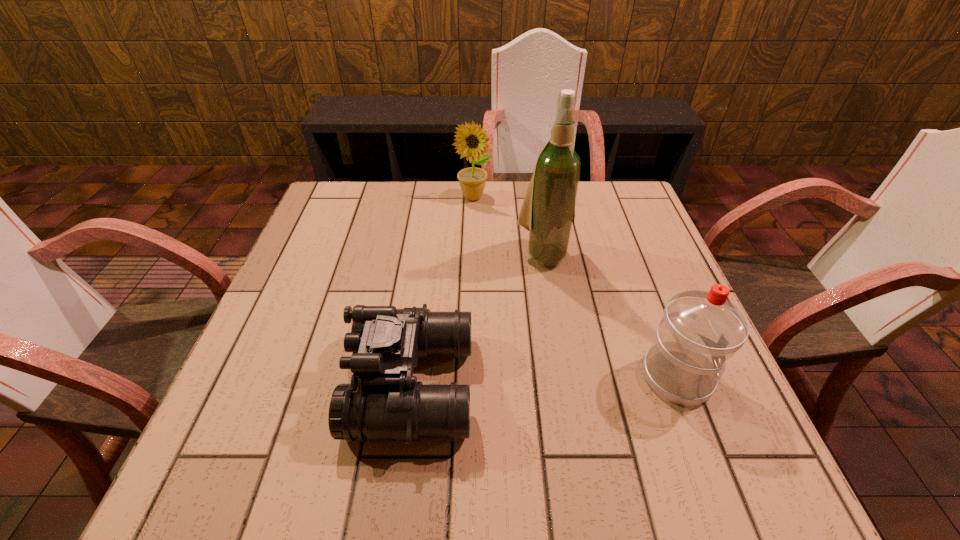
Locate an element on the screen. vacant space that satisfies the following two spatial constraints: 1. on the front side of the rightmost object; 2. on the handle side of the wine bottle is located at coordinates [564, 377].